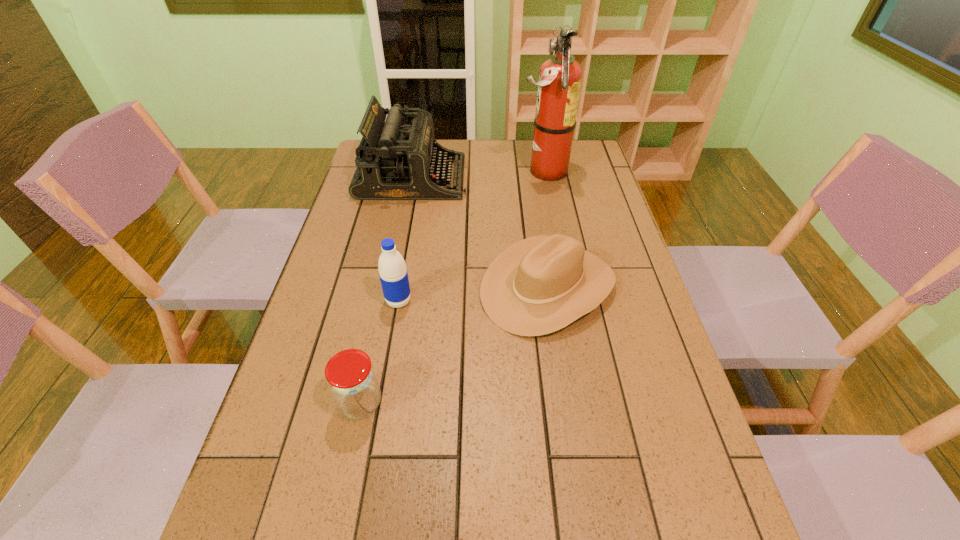
Find the location of a particular element. The width and height of the screenshot is (960, 540). free spot that satisfies the following two spatial constraints: 1. on the keyboard of the second tallest object; 2. on the right side of the third tallest object is located at coordinates (388, 301).

Where is `free point that satisfies the following two spatial constraints: 1. on the back side of the third shortest object; 2. on the right side of the cowboy hat`? free point that satisfies the following two spatial constraints: 1. on the back side of the third shortest object; 2. on the right side of the cowboy hat is located at coordinates (401, 287).

At what (x,y) coordinates should I click in order to perform the action: click on vacant point that satisfies the following two spatial constraints: 1. on the keyboard of the cowboy hat; 2. on the left side of the typewriter. Please return your answer as a coordinate pair (x, y). This screenshot has width=960, height=540. Looking at the image, I should click on (391, 287).

You are a GUI agent. You are given a task and a screenshot of the screen. Output one action in this format:
    pyautogui.click(x=<x>, y=<y>)
    Task: Click on the vacant point that satisfies the following two spatial constraints: 1. on the keyboard of the typewriter; 2. on the right side of the third tallest object
    This screenshot has width=960, height=540.
    Given the screenshot: What is the action you would take?
    pyautogui.click(x=388, y=301)

At what (x,y) coordinates should I click in order to perform the action: click on free space that satisfies the following two spatial constraints: 1. on the back side of the cowboy hat; 2. on the left side of the jar. Please return your answer as a coordinate pair (x, y). The width and height of the screenshot is (960, 540). Looking at the image, I should click on (385, 287).